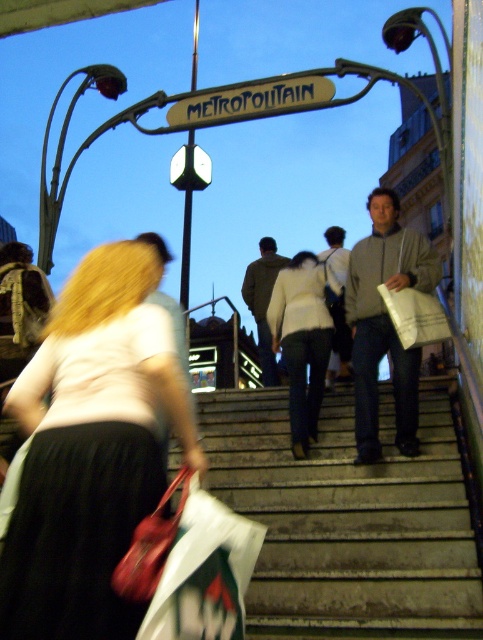
Between concrete stairs at center and matte white blouse at lower left, which one is positioned higher?

matte white blouse at lower left is higher up.

Between concrete stairs at center and matte white blouse at lower left, which one has less height?

concrete stairs at center

Does point (278, 435) lie in front of point (184, 378)?

No, (278, 435) is behind (184, 378).

The width and height of the screenshot is (483, 640). Find the location of `concrete stairs at center`. concrete stairs at center is located at coordinates (347, 520).

Who is higher up, white matte jacket at center or metallic gold sign at upper center?

metallic gold sign at upper center

Is the position of white matte jacket at center less distant than that of metallic gold sign at upper center?

Yes, white matte jacket at center is closer to the viewer.

What do you see at coordinates (302, 340) in the screenshot? I see `white matte jacket at center` at bounding box center [302, 340].

I want to click on white matte jacket at center, so [x=302, y=340].

Consider the image. Does matte white blouse at lower left lie behind metallic gold sign at upper center?

No, it is not.

Is matte white blouse at lower left bigger than metallic gold sign at upper center?

Yes, matte white blouse at lower left is bigger than metallic gold sign at upper center.

Describe the element at coordinates (91, 449) in the screenshot. I see `matte white blouse at lower left` at that location.

Identify the location of matte white blouse at lower left. The width and height of the screenshot is (483, 640). (91, 449).